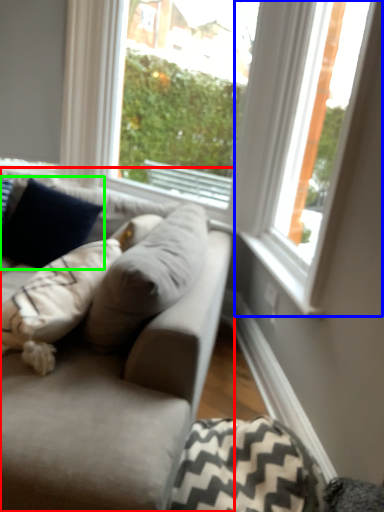
Question: Considering the real-world distances, which object is farthest from studio couch (highlighted by a red box)? window (highlighted by a blue box) or pillow (highlighted by a green box)?

Choices:
 (A) window
 (B) pillow

Answer: (B)